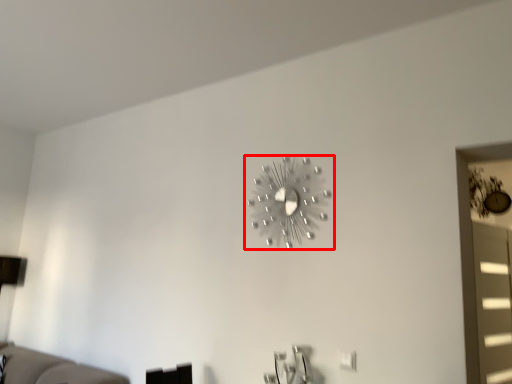
Question: Considering the relative positions of wall clock (annotated by the red box) and window in the image provided, where is wall clock (annotated by the red box) located with respect to the staircase?

Choices:
 (A) right
 (B) left

Answer: (B)